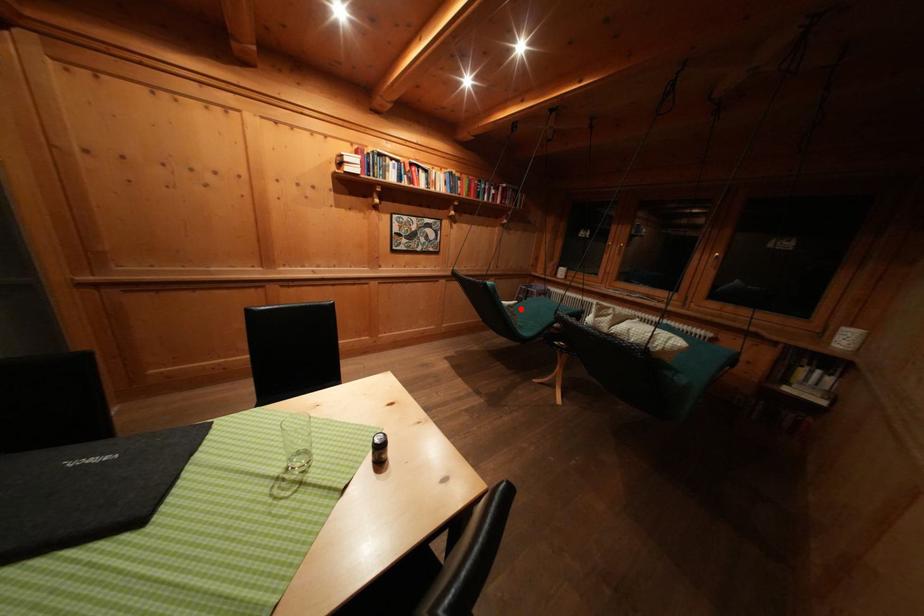
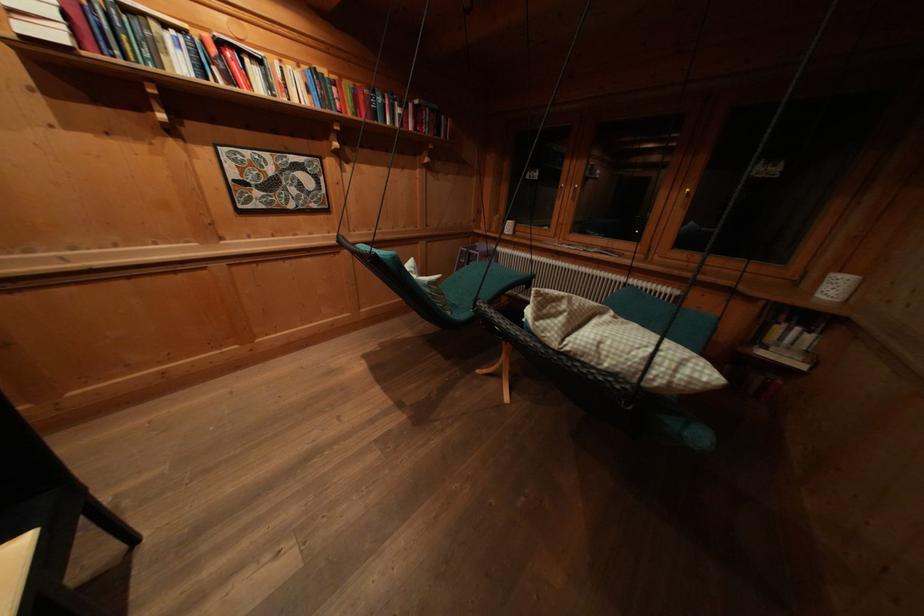
Where in the second image is the point corresponding to the highlighted location from the first image?

(444, 285)